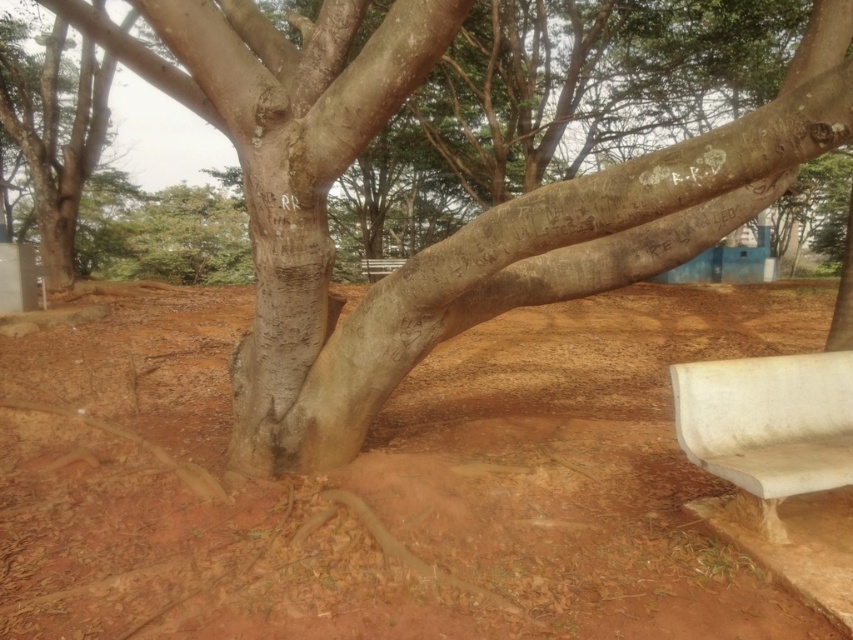
Question: Is the position of smooth bark tree at center less distant than that of white plastic bench at center?

Choices:
 (A) yes
 (B) no

Answer: (A)

Question: Which point is closer to the camera taking this photo?

Choices:
 (A) (616, 253)
 (B) (759, 589)
 (C) (778, 481)

Answer: (B)

Question: Can you confirm if brown soil at center is positioned above white marble bench at lower right?

Choices:
 (A) yes
 (B) no

Answer: (A)

Question: Which point is farther to the camera?

Choices:
 (A) white plastic bench at center
 (B) brown soil at center
 (C) white marble bench at lower right
 (D) smooth bark tree at center

Answer: (A)

Question: Which is nearer to the white marble bench at lower right?

Choices:
 (A) white plastic bench at center
 (B) brown soil at center

Answer: (B)

Question: Is white marble bench at lower right smaller than white plastic bench at center?

Choices:
 (A) yes
 (B) no

Answer: (A)